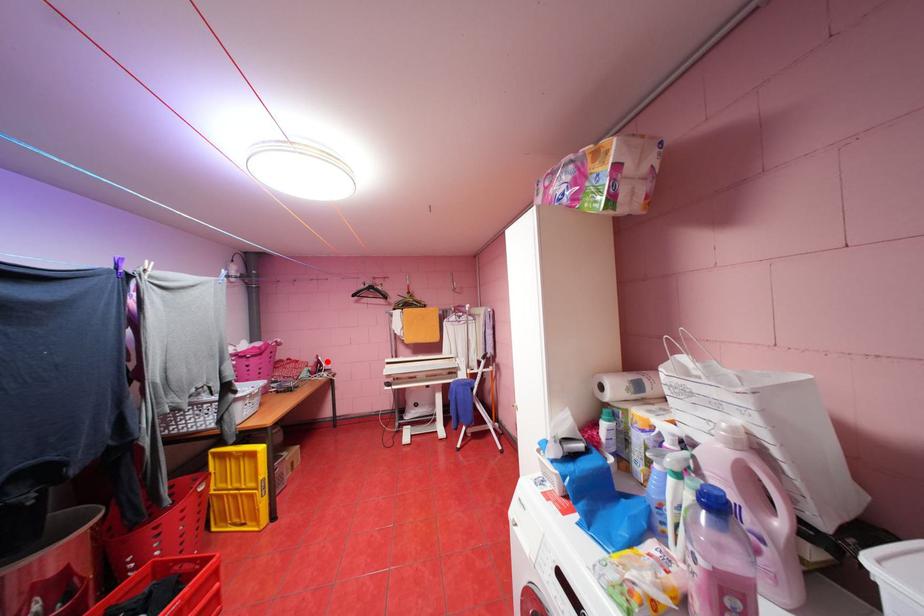
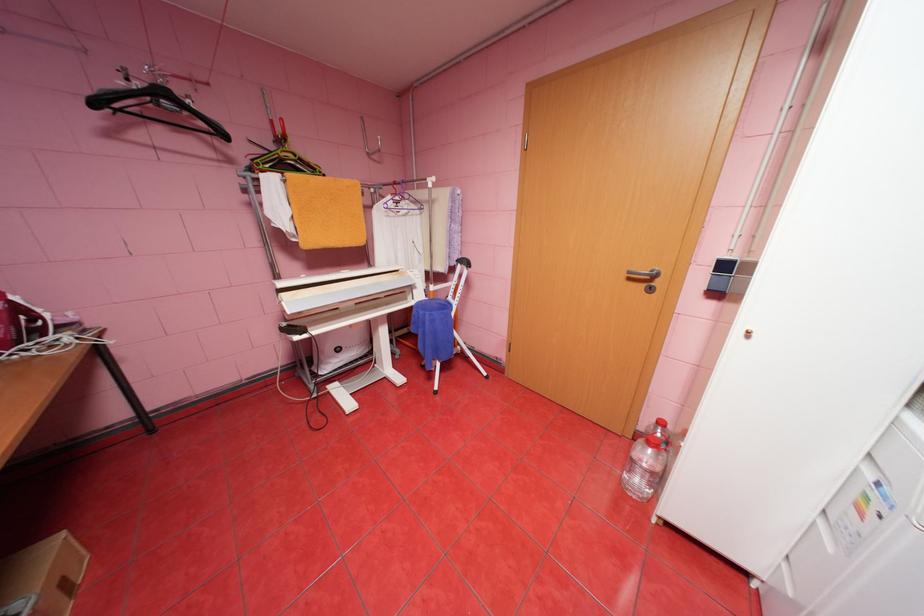
Where in the second image is the point corresponding to the highlighted location from the first image?

(26, 309)